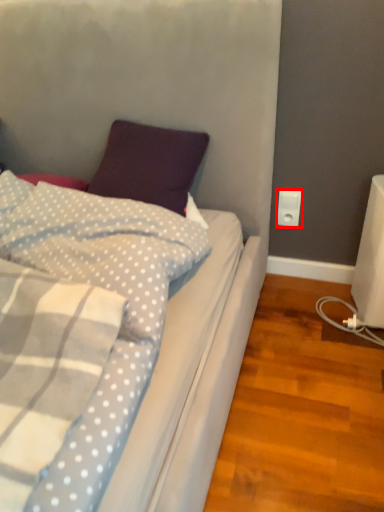
Question: Where is power plugs and sockets (annotated by the red box) located in relation to pillow in the image?

Choices:
 (A) right
 (B) left

Answer: (A)